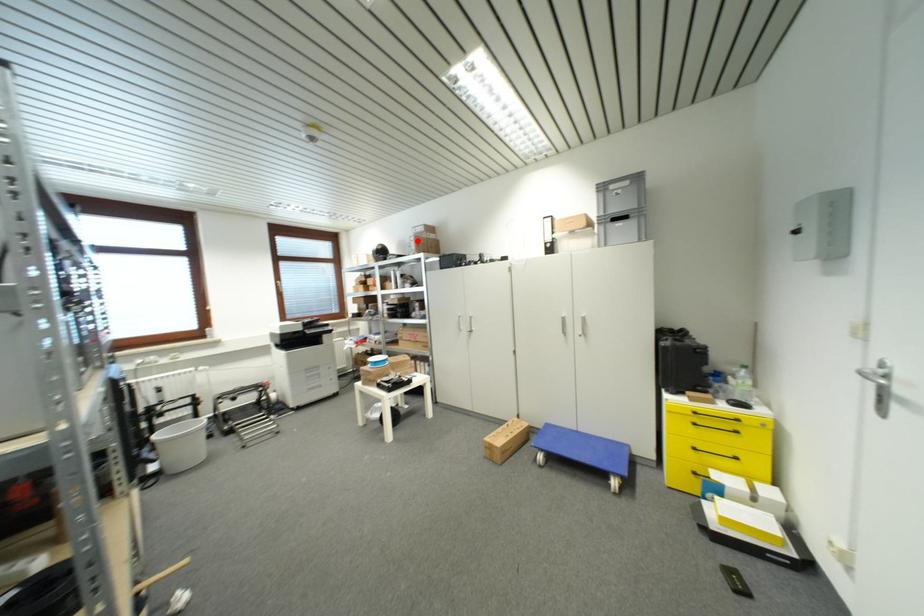
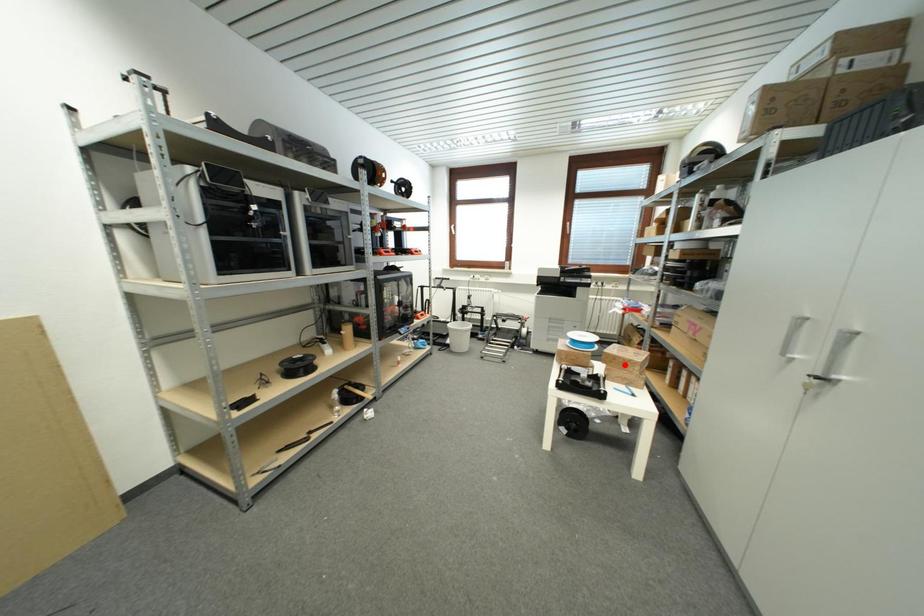
I am providing you with two images of the same scene from different viewpoints. A red point is marked on the first image and another point is marked on the second image. Is the marked point in image1 the same physical position as the marked point in image2?

No